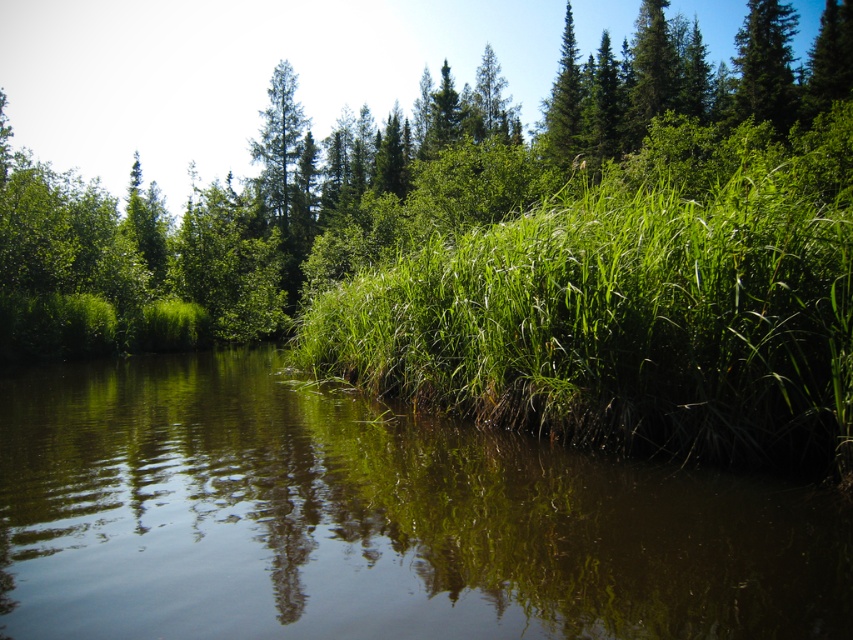
Question: Based on their relative distances, which object is farther from the green grassy at center?

Choices:
 (A) green matte tree at upper right
 (B) green grassy river at center
 (C) green leafy shrub at center

Answer: (A)

Question: Which point is closer to the camera taking this photo?

Choices:
 (A) (128, 561)
 (B) (634, 385)

Answer: (A)

Question: Does green grassy river at center have a lesser width compared to green leafy shrub at center?

Choices:
 (A) no
 (B) yes

Answer: (B)

Question: Is green leafy shrub at center below green matte tree at upper right?

Choices:
 (A) yes
 (B) no

Answer: (B)

Question: Does green grassy river at center appear on the left side of green grassy at center?

Choices:
 (A) no
 (B) yes

Answer: (B)

Question: Which object appears closest to the camera in this image?

Choices:
 (A) green grassy at center
 (B) green grassy river at center
 (C) green matte tree at upper right

Answer: (B)